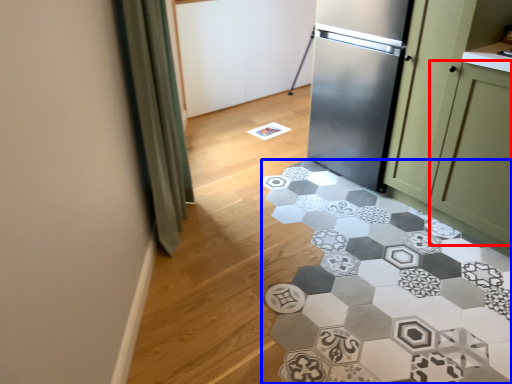
Question: Which of the following is the closest to the observer, glass door (highlighted by a red box) or marble (highlighted by a blue box)?

Choices:
 (A) glass door
 (B) marble

Answer: (B)